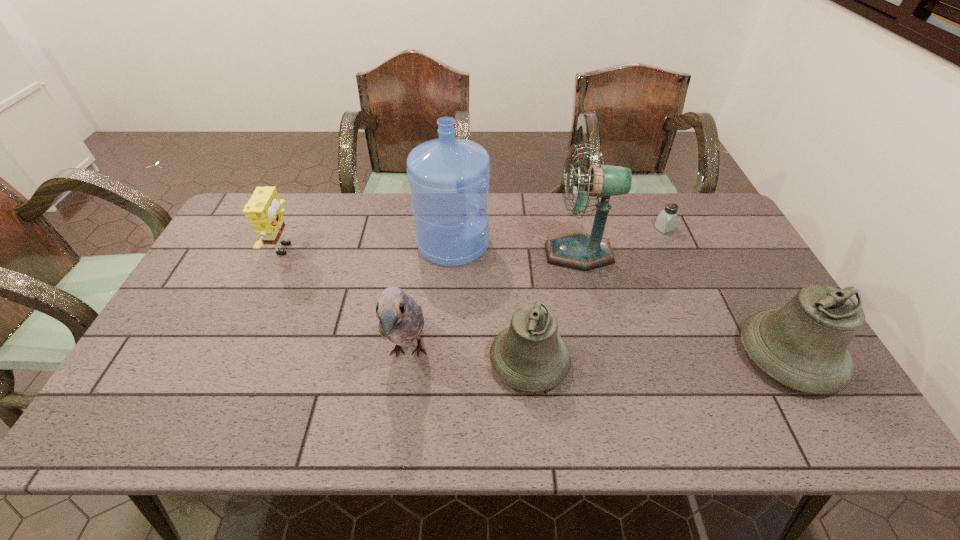
Please point out where to position a new bell on the left to maintain spacing. Please provide its 2D coordinates. Your answer should be formatted as a tuple, i.e. [(x, y)], where the tuple contains the x and y coordinates of a point satisfying the conditions above.

[(264, 367)]